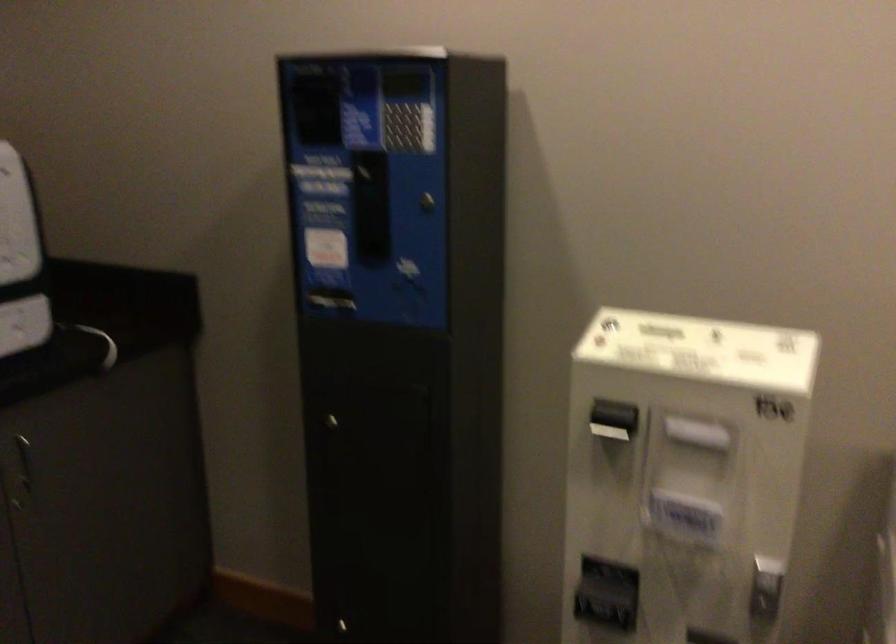
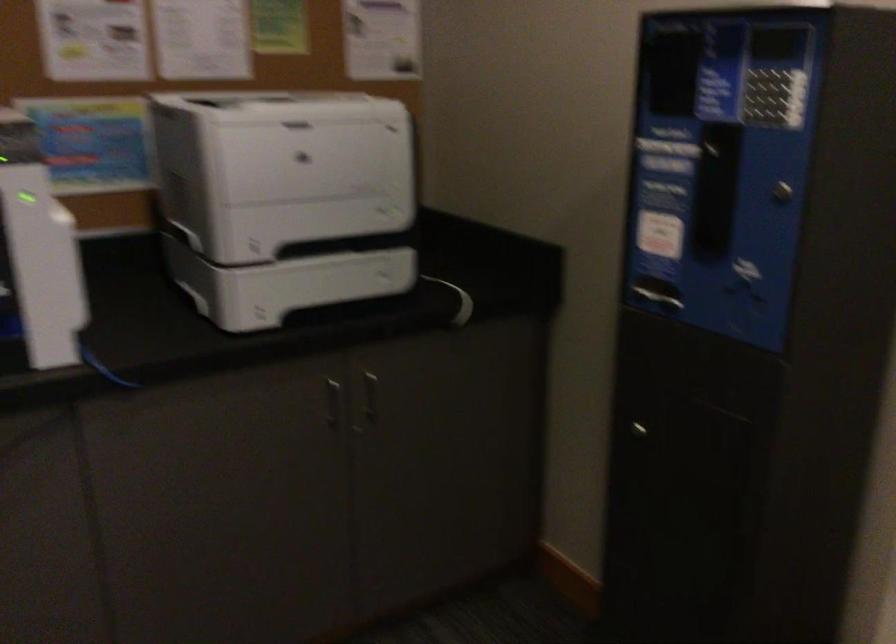
Where in the second image is the point corresponding to (409,86) from the first image?

(780, 44)